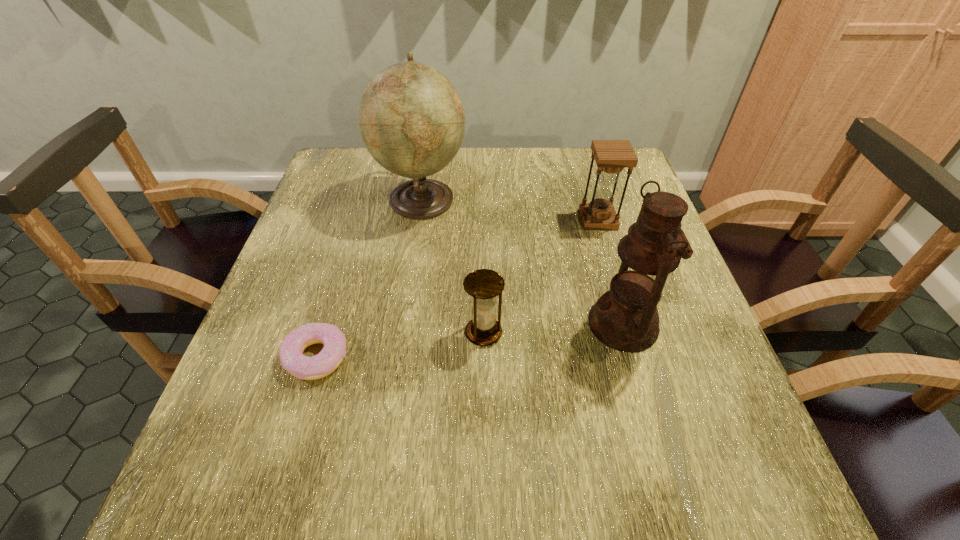
What are the coordinates of `the tallest object` in the screenshot? It's located at (411, 118).

Image resolution: width=960 pixels, height=540 pixels. What are the coordinates of `oil lamp` in the screenshot? It's located at (625, 318).

The image size is (960, 540). What are the coordinates of `the right hourglass` in the screenshot? It's located at (611, 156).

The width and height of the screenshot is (960, 540). In order to click on the farther hourglass in this screenshot , I will do `click(611, 156)`.

Locate an element on the screen. This screenshot has width=960, height=540. the third object from right to left is located at coordinates (484, 285).

You are a GUI agent. You are given a task and a screenshot of the screen. Output one action in this format:
    pyautogui.click(x=<x>, y=<y>)
    Task: Click on the shorter hourglass
    
    Given the screenshot: What is the action you would take?
    pyautogui.click(x=484, y=285)

Where is `doughnut`? This screenshot has width=960, height=540. doughnut is located at coordinates (292, 359).

The width and height of the screenshot is (960, 540). I want to click on free spot located 0.210m on the front-facing side of the globe, so click(x=546, y=199).

Identify the location of free spot located 0.330m on the back of the oil lamp. (588, 199).

This screenshot has height=540, width=960. In order to click on free point located on the left of the taller hourglass in this screenshot , I will do `click(505, 220)`.